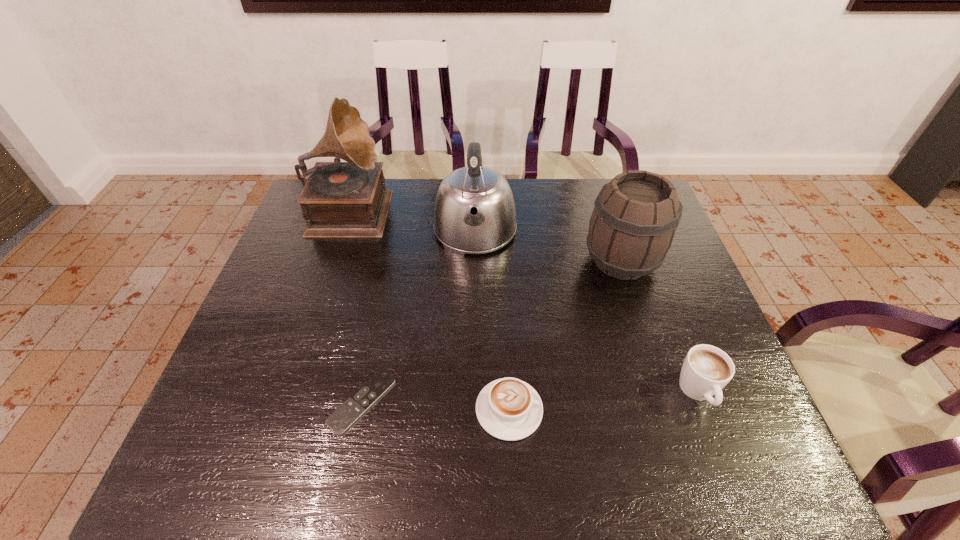
Where is `cappuccino that is at the right edge`? cappuccino that is at the right edge is located at coordinates (706, 370).

Where is `object located at the far left corner`? object located at the far left corner is located at coordinates (348, 199).

Where is `free spot at the far edge of the desktop`? free spot at the far edge of the desktop is located at coordinates (555, 199).

Find the location of a particular element. The width and height of the screenshot is (960, 540). vacant space at the near edge is located at coordinates (550, 440).

Find the location of a particular element. This screenshot has height=540, width=960. vacant position at the left edge of the desktop is located at coordinates (279, 428).

Where is `vacant space at the right edge of the desktop`? Image resolution: width=960 pixels, height=540 pixels. vacant space at the right edge of the desktop is located at coordinates (688, 430).

Find the location of `vacant point located between the remote control and the kettle`. vacant point located between the remote control and the kettle is located at coordinates (419, 316).

Where is `free spot between the kettle and the right cappuccino`? free spot between the kettle and the right cappuccino is located at coordinates (587, 312).

At what (x,y) coordinates should I click in order to perform the action: click on free area in between the kettle and the tallest object. Please return your answer as a coordinate pair (x, y). Looking at the image, I should click on (413, 219).

The width and height of the screenshot is (960, 540). In order to click on vacant space that's between the shorter cappuccino and the kettle in this screenshot , I will do `click(492, 320)`.